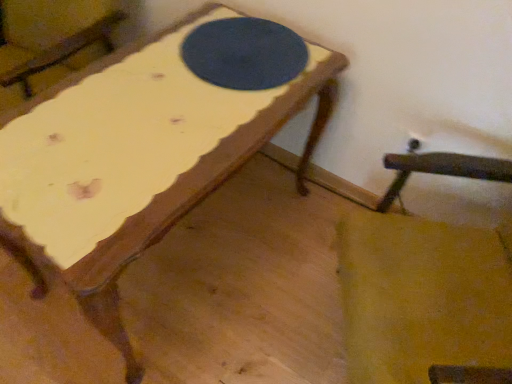
In order to face wooden rocking chair at lower right, should I rotate leftwards or rightwards?

Turn right approximately 29.145 degrees to face it.

Describe the element at coordinates (421, 297) in the screenshot. I see `wooden rocking chair at lower right` at that location.

I want to click on wooden rocking chair at lower right, so click(x=421, y=297).

Find the location of `dark blue felt table tennis table at center`. dark blue felt table tennis table at center is located at coordinates (244, 53).

From the picture: Measure the distance between point (282, 63) and camera.

A distance of 1.21 meters exists between point (282, 63) and camera.

Describe the element at coordinates (244, 53) in the screenshot. I see `dark blue felt table tennis table at center` at that location.

This screenshot has width=512, height=384. In order to click on wooden rocking chair at lower right in this screenshot , I will do `click(421, 297)`.

Is dark blue felt table tennis table at center to the left of wooden rocking chair at lower right from the viewer's perspective?

Correct, you'll find dark blue felt table tennis table at center to the left of wooden rocking chair at lower right.

Is the position of dark blue felt table tennis table at center more distant than that of wooden rocking chair at lower right?

Yes, it is.

Which is in front, point (234, 61) or point (413, 321)?

Point (413, 321)

From the image's perspective, relative to wooden rocking chair at lower right, is dark blue felt table tennis table at center above or below?

dark blue felt table tennis table at center is situated higher than wooden rocking chair at lower right in the image.

From a real-world perspective, is dark blue felt table tennis table at center physically above wooden rocking chair at lower right?

Yes, from a real-world perspective, dark blue felt table tennis table at center is above wooden rocking chair at lower right.

Looking at their sizes, would you say dark blue felt table tennis table at center is wider or thinner than wooden rocking chair at lower right?

Considering their sizes, dark blue felt table tennis table at center looks slimmer than wooden rocking chair at lower right.

Does dark blue felt table tennis table at center have a lesser height compared to wooden rocking chair at lower right?

Correct, dark blue felt table tennis table at center is not as tall as wooden rocking chair at lower right.

Considering the sizes of dark blue felt table tennis table at center and wooden rocking chair at lower right in the image, is dark blue felt table tennis table at center bigger or smaller than wooden rocking chair at lower right?

Clearly, dark blue felt table tennis table at center is smaller in size than wooden rocking chair at lower right.

Can wooden rocking chair at lower right be found inside dark blue felt table tennis table at center?

No, wooden rocking chair at lower right is located outside of dark blue felt table tennis table at center.

Is dark blue felt table tennis table at center in contact with wooden rocking chair at lower right?

dark blue felt table tennis table at center and wooden rocking chair at lower right are clearly separated.

Could you tell me if dark blue felt table tennis table at center is facing wooden rocking chair at lower right?

No, dark blue felt table tennis table at center is not turned towards wooden rocking chair at lower right.

The image size is (512, 384). I want to click on rocking chair on the right of dark blue felt table tennis table at center, so click(x=421, y=297).

Considering the relative positions of wooden rocking chair at lower right and dark blue felt table tennis table at center in the image provided, is wooden rocking chair at lower right to the left of dark blue felt table tennis table at center from the viewer's perspective?

No, wooden rocking chair at lower right is not to the left of dark blue felt table tennis table at center.

Considering their positions, is wooden rocking chair at lower right located in front of or behind dark blue felt table tennis table at center?

In the image, wooden rocking chair at lower right appears in front of dark blue felt table tennis table at center.

Between point (482, 290) and point (218, 33), which one is positioned in front?

Positioned in front is point (482, 290).

From the image's perspective, would you say wooden rocking chair at lower right is positioned over dark blue felt table tennis table at center?

No, from the image's perspective, wooden rocking chair at lower right is not over dark blue felt table tennis table at center.

Consider the image. From a real-world perspective, does wooden rocking chair at lower right stand above dark blue felt table tennis table at center?

Incorrect, from a real-world perspective, wooden rocking chair at lower right is lower than dark blue felt table tennis table at center.

From the picture: Between wooden rocking chair at lower right and dark blue felt table tennis table at center, which one has larger width?

wooden rocking chair at lower right.

Can you confirm if wooden rocking chair at lower right is taller than dark blue felt table tennis table at center?

Yes.

Which of these two, wooden rocking chair at lower right or dark blue felt table tennis table at center, is smaller?

dark blue felt table tennis table at center is smaller.

Is dark blue felt table tennis table at center located within wooden rocking chair at lower right?

Actually, dark blue felt table tennis table at center is outside wooden rocking chair at lower right.

Is wooden rocking chair at lower right in contact with dark blue felt table tennis table at center?

No, wooden rocking chair at lower right is not in contact with dark blue felt table tennis table at center.

Is wooden rocking chair at lower right facing towards dark blue felt table tennis table at center?

No, wooden rocking chair at lower right is not facing towards dark blue felt table tennis table at center.

How many degrees apart are the facing directions of wooden rocking chair at lower right and dark blue felt table tennis table at center?

They differ by 57.9 degrees in their facing directions.

At what (x,y) coordinates should I click in order to perform the action: click on table tennis table above the wooden rocking chair at lower right (from a real-world perspective). Please return your answer as a coordinate pair (x, y). Looking at the image, I should click on (244, 53).

This screenshot has height=384, width=512. Identify the location of table tennis table above the wooden rocking chair at lower right (from a real-world perspective). (244, 53).

Identify the location of rocking chair on the right side of dark blue felt table tennis table at center. This screenshot has height=384, width=512. (421, 297).